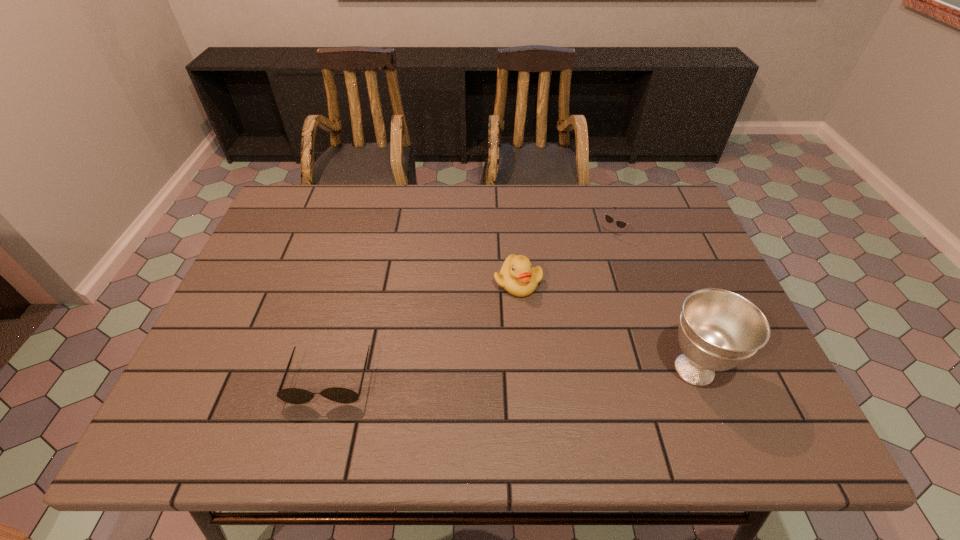
Where is `free location located in front of the lenses of the farther sunglasses`? The height and width of the screenshot is (540, 960). free location located in front of the lenses of the farther sunglasses is located at coordinates (585, 261).

Locate an element on the screen. vacant space located on the beak of the third nearest object is located at coordinates (493, 345).

Find the location of a particular element. The width and height of the screenshot is (960, 540). free location located on the beak of the third nearest object is located at coordinates (489, 358).

Where is `free space located 0.070m on the beak of the third nearest object`? The image size is (960, 540). free space located 0.070m on the beak of the third nearest object is located at coordinates (503, 319).

In order to click on object that is at the far edge in this screenshot , I will do `click(621, 224)`.

Where is `sunglasses present at the near edge`? The image size is (960, 540). sunglasses present at the near edge is located at coordinates (296, 396).

You are a GUI agent. You are given a task and a screenshot of the screen. Output one action in this format:
    pyautogui.click(x=<x>, y=<y>)
    Task: Click on the chalice situated at the near edge
    
    Given the screenshot: What is the action you would take?
    pyautogui.click(x=718, y=330)

This screenshot has width=960, height=540. What are the coordinates of `object at the right edge` in the screenshot? It's located at (718, 330).

Identify the location of object present at the near right corner. This screenshot has height=540, width=960. (718, 330).

This screenshot has height=540, width=960. I want to click on free space at the far edge, so click(x=421, y=192).